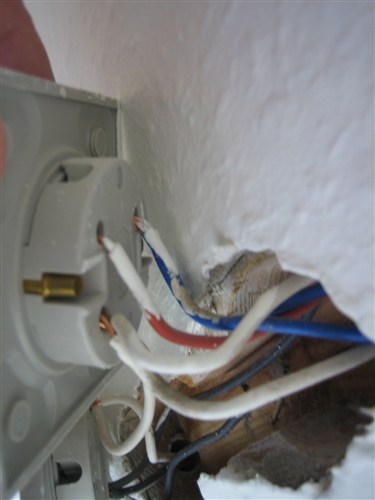
This screenshot has width=375, height=500. Identify the location of hole in wall. (330, 314).